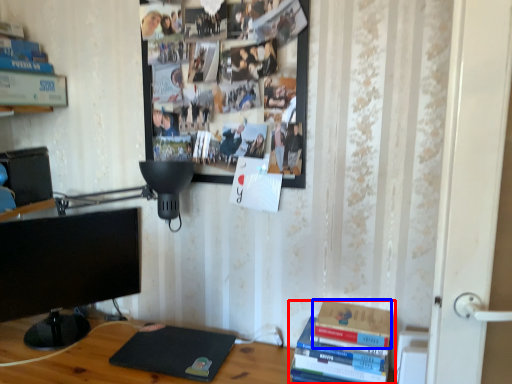
Question: Which point is closer to the camera, book (highlighted by a red box) or paperback book (highlighted by a blue box)?

Choices:
 (A) book
 (B) paperback book

Answer: (A)